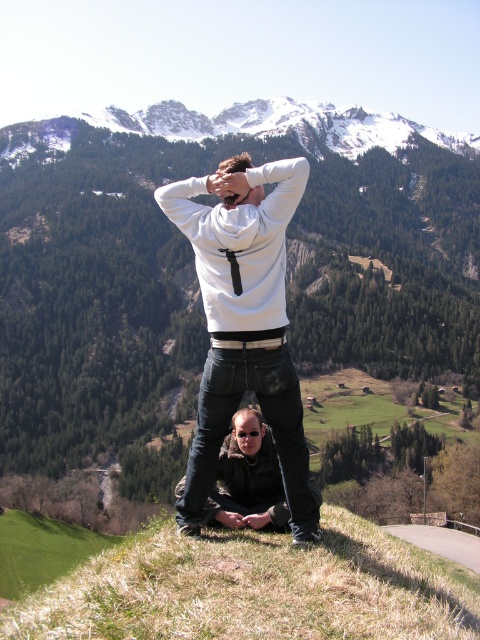
Looking at this image, you are a photographer trying to capture both the white matte hoodie at center and the black leather jacket at lower center in a single frame. Which clothing item will appear larger in the photo?

The white matte hoodie at center will appear larger in the photo since it is bigger than the black leather jacket at lower center.

You are a photographer trying to capture a group photo of the two people in the scene. You notice the white matte hoodie at center and the black leather jacket at lower center. Since you want everyone to be visible in the photo, which clothing item should you position closer to the camera to ensure it doesn t block others?

The white matte hoodie at center has a larger width than the black leather jacket at lower center. To prevent blocking others, position the white matte hoodie at center closer to the camera so its greater width doesn t obscure the view of the other person.